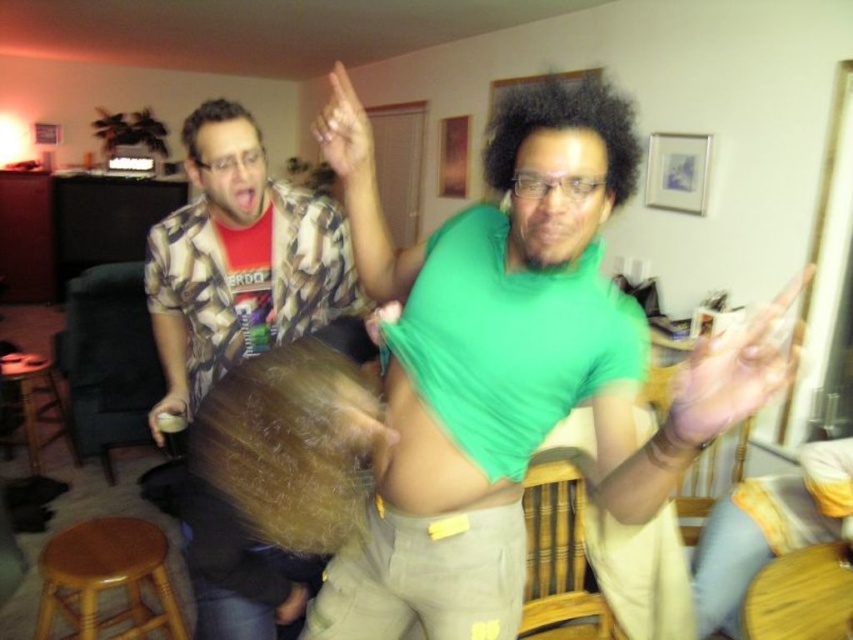
Question: Which point appears closest to the camera in this image?

Choices:
 (A) (54, 397)
 (B) (354, 308)
 (C) (167, 410)
 (D) (709, 388)

Answer: (D)

Question: Does wooden bar stool at lower left have a larger size compared to matte plastic cup at lower left?

Choices:
 (A) no
 (B) yes

Answer: (B)

Question: Is green matte shirt at center wider than printed cotton shirt at upper left?

Choices:
 (A) yes
 (B) no

Answer: (B)

Question: Which of the following is the farthest from the observer?

Choices:
 (A) translucent plastic hand at upper right
 (B) light brown wooden stool at lower left

Answer: (A)

Question: Which point is closer to the camera taking this photo?

Choices:
 (A) (33, 371)
 (B) (703, 400)
 (C) (170, 413)
 (D) (373, 179)

Answer: (B)

Question: Does green matte shirt at center come in front of light brown wooden stool at lower left?

Choices:
 (A) no
 (B) yes

Answer: (B)